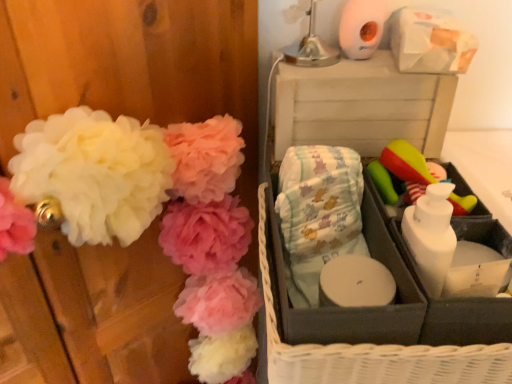
Question: Can you confirm if gray fabric basket at right is shorter than white plastic storage box at upper right?

Choices:
 (A) no
 (B) yes

Answer: (B)

Question: Can you confirm if gray fabric basket at right is taller than white plastic storage box at upper right?

Choices:
 (A) no
 (B) yes

Answer: (A)

Question: From a real-world perspective, is gray fabric basket at right beneath white plastic storage box at upper right?

Choices:
 (A) no
 (B) yes

Answer: (B)

Question: Considering the relative positions of gray fabric basket at right and white plastic storage box at upper right in the image provided, is gray fabric basket at right behind white plastic storage box at upper right?

Choices:
 (A) yes
 (B) no

Answer: (B)

Question: Is white plastic storage box at upper right at the back of gray fabric basket at right?

Choices:
 (A) yes
 (B) no

Answer: (A)

Question: Is green rubber brush at right taller or shorter than white matte toilet paper at upper right?

Choices:
 (A) tall
 (B) short

Answer: (B)

Question: From a real-world perspective, is green rubber brush at right positioned above or below white matte toilet paper at upper right?

Choices:
 (A) above
 (B) below

Answer: (B)

Question: In terms of width, does green rubber brush at right look wider or thinner when compared to white matte toilet paper at upper right?

Choices:
 (A) wide
 (B) thin

Answer: (A)

Question: Is green rubber brush at right spatially inside white matte toilet paper at upper right, or outside of it?

Choices:
 (A) inside
 (B) outside

Answer: (B)

Question: Looking at the image, does white plastic storage box at upper right seem bigger or smaller compared to light blue fabric diapers at center?

Choices:
 (A) big
 (B) small

Answer: (A)

Question: Would you say white plastic storage box at upper right is inside or outside light blue fabric diapers at center?

Choices:
 (A) inside
 (B) outside

Answer: (B)

Question: In the image, is white plastic storage box at upper right on the left side or the right side of light blue fabric diapers at center?

Choices:
 (A) left
 (B) right

Answer: (B)

Question: From a real-world perspective, is white plastic storage box at upper right above or below light blue fabric diapers at center?

Choices:
 (A) below
 (B) above

Answer: (A)

Question: Is white fluffy pom-poms at left situated inside white plastic storage box at upper right or outside?

Choices:
 (A) outside
 (B) inside

Answer: (A)

Question: From a real-world perspective, is white fluffy pom-poms at left positioned above or below white plastic storage box at upper right?

Choices:
 (A) above
 (B) below

Answer: (B)